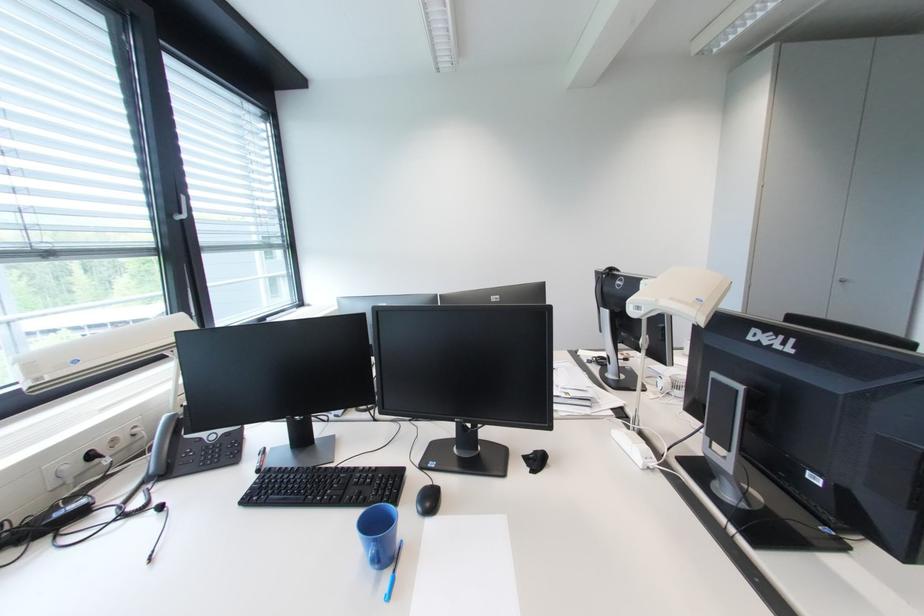
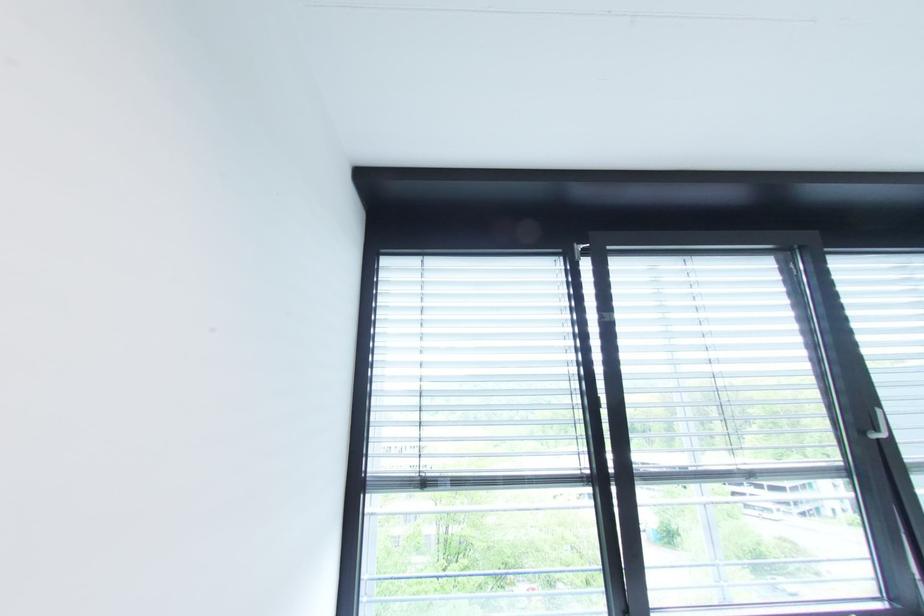
Where in the second image is the point corresponding to (x=189, y=217) from the first image?

(889, 437)